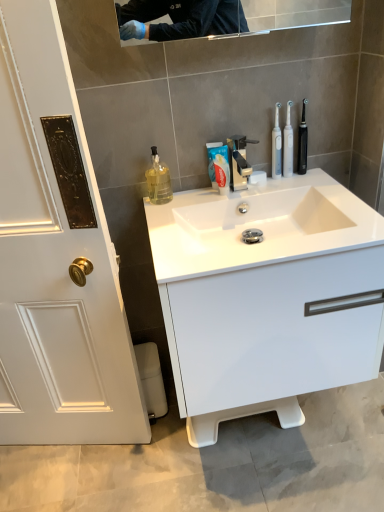
Find the location of a particular element. The image size is (384, 512). vacant space situated on the left part of black plastic toothbrush at right, the 2th toothbrush positioned from the left is located at coordinates (264, 187).